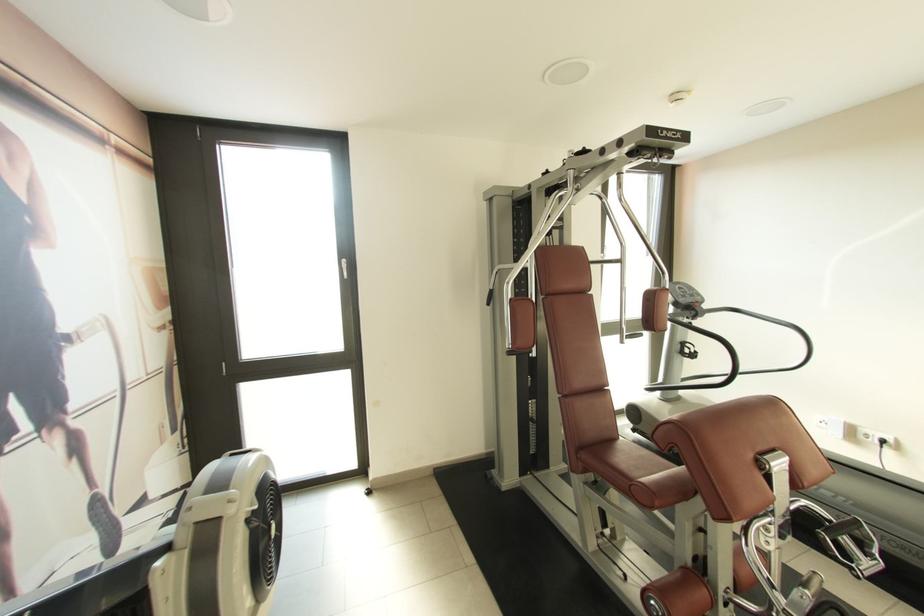
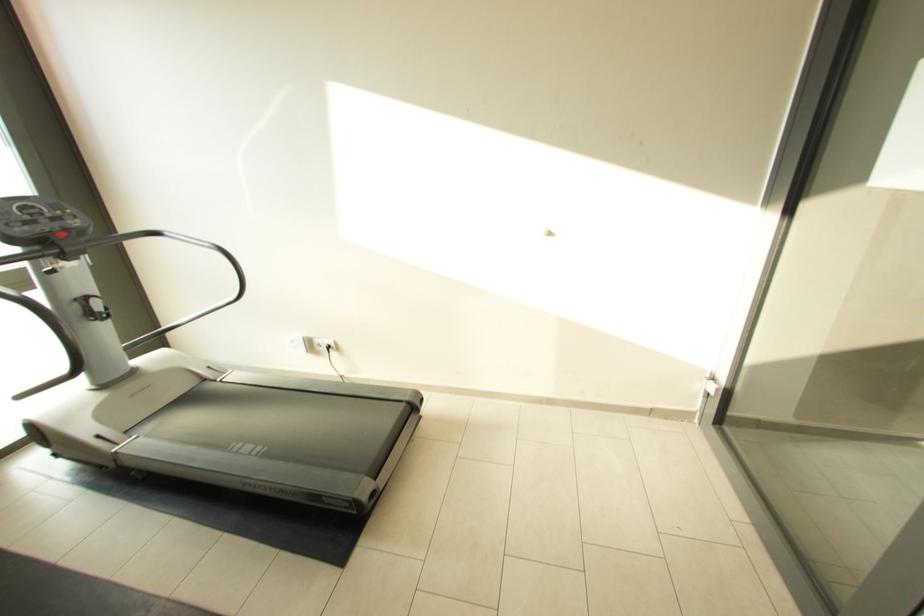
Locate, in the second image, the point that corresponds to point 868,432 in the first image.

(322, 342)